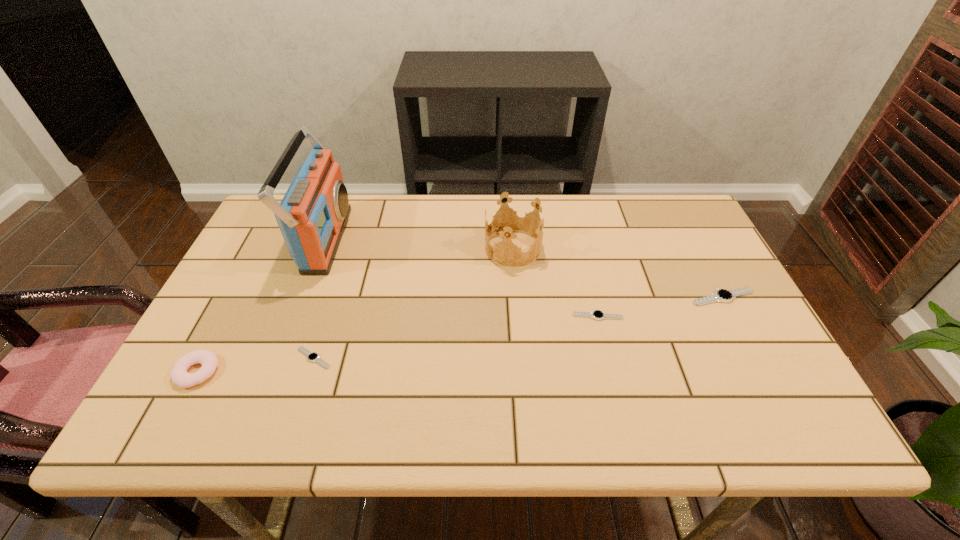
At what (x,y) coordinates should I click in order to perform the action: click on doughnut. Please return your answer as a coordinate pair (x, y). The height and width of the screenshot is (540, 960). Looking at the image, I should click on (179, 375).

Where is `vacant region located 0.120m on the left of the shortest watch`? vacant region located 0.120m on the left of the shortest watch is located at coordinates (243, 358).

I want to click on blank space located on the right of the second watch from left to right, so click(723, 316).

This screenshot has height=540, width=960. I want to click on vacant space located on the left of the rightmost watch, so click(613, 297).

The image size is (960, 540). What are the coordinates of `free location located 0.060m on the front-facing side of the radio receiver` in the screenshot? It's located at (365, 239).

You are a GUI agent. You are given a task and a screenshot of the screen. Output one action in this format:
    pyautogui.click(x=<x>, y=<y>)
    Task: Click on the free space located 0.190m on the right of the fifth shortest object
    This screenshot has height=540, width=960.
    Given the screenshot: What is the action you would take?
    pyautogui.click(x=607, y=248)

Locate an element on the screen. This screenshot has height=540, width=960. vacant space located on the back of the doughnut is located at coordinates (232, 305).

You are a GUI agent. You are given a task and a screenshot of the screen. Output one action in this format:
    pyautogui.click(x=<x>, y=<y>)
    Task: Click on the radio receiver positioned at the far edge
    The height and width of the screenshot is (540, 960).
    Given the screenshot: What is the action you would take?
    pyautogui.click(x=312, y=216)

You are a GUI agent. You are given a task and a screenshot of the screen. Output one action in this format:
    pyautogui.click(x=<x>, y=<y>)
    Task: Click on the crown that is at the far edge
    The image size is (960, 540).
    Given the screenshot: What is the action you would take?
    pyautogui.click(x=514, y=221)

Locate an element on the screen. watch situated at the near edge is located at coordinates 314,357.